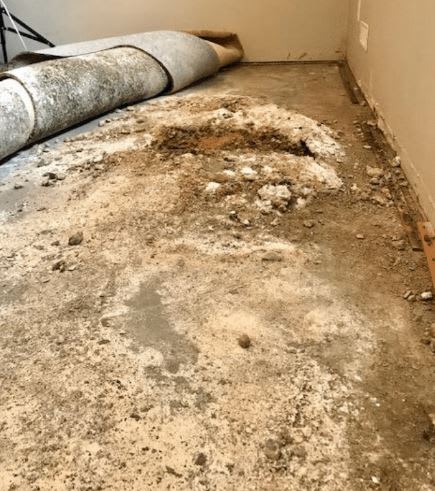
Locate an element on the screen. electrical outlet is located at coordinates (361, 35).